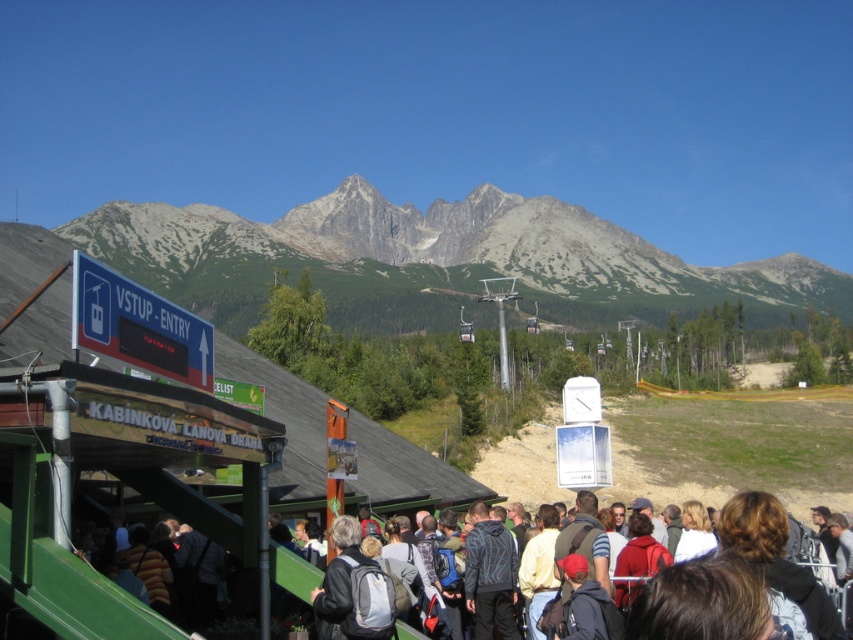
You are standing at the ski resort and want to take a photo of the gray rocky mountain at upper center and the dark gray backpack at center. Which object should you focus on first to ensure both are in the frame?

You should focus on the dark gray backpack at center first because it is closer to you than the gray rocky mountain at upper center, ensuring both are in the frame.

You are a visitor at the ski resort and want to take the cable car. The gray rocky mountain at upper center has a cable car station on its peak. Can you see the green metal ski resort at center from the cable car station?

The green metal ski resort at center is behind gray rocky mountain at upper center, so from the cable car station on the peak of the gray rocky mountain at upper center, you would not be able to see the green metal ski resort at center because it is obscured by the mountain itself.

You are planning to take a photo of the gray rocky mountain at upper center and the dark gray backpack at center. Which object should you focus on first if you want both to be in the same frame without moving the camera?

The gray rocky mountain at upper center is bigger than the dark gray backpack at center, so you should focus on the gray rocky mountain at upper center first to ensure both are in the frame.